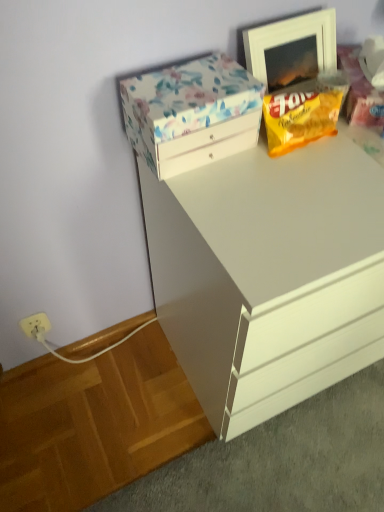
The width and height of the screenshot is (384, 512). What are the coordinates of `vacant space situated above white glossy chest of drawers at upper center (from a real-world perspective)` in the screenshot? It's located at (315, 174).